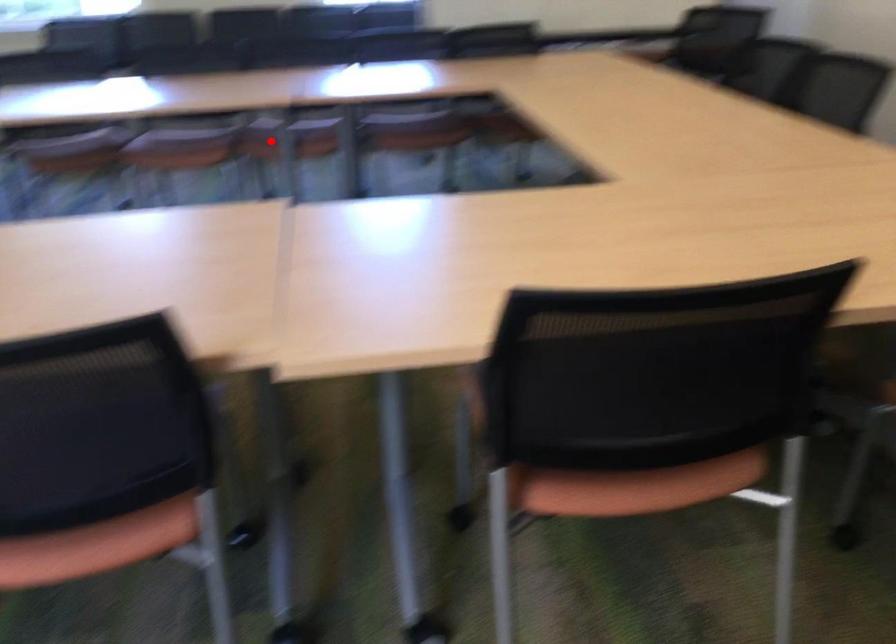
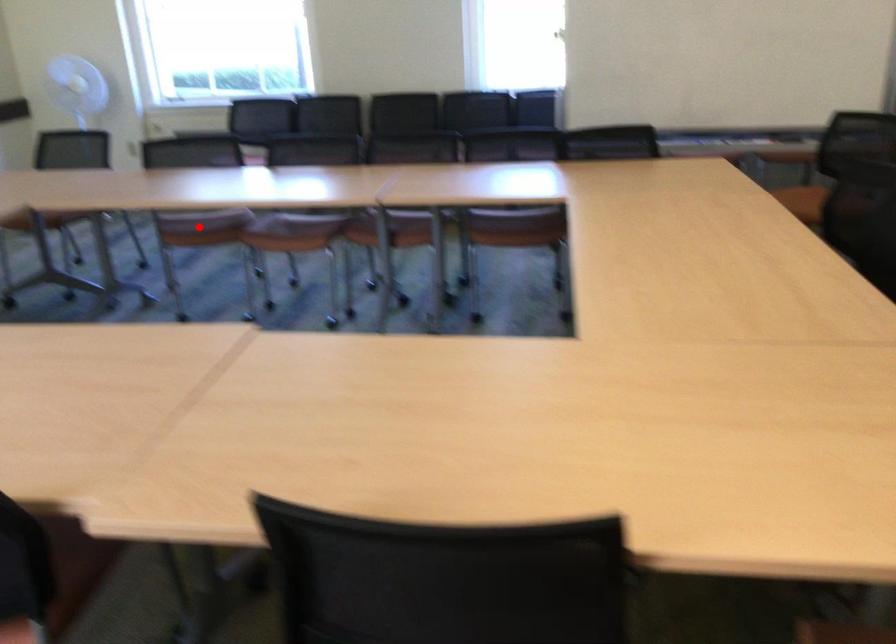
I am providing you with two images of the same scene from different viewpoints. A red point is marked on the first image and another point is marked on the second image. Is the marked point in image1 the same physical position as the marked point in image2?

No